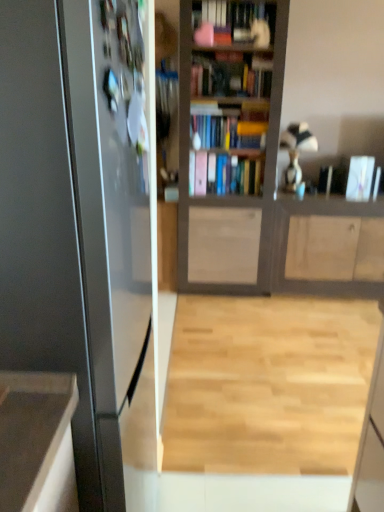
Question: From a real-world perspective, is light wood floor at center over wooden cabinet at center?

Choices:
 (A) no
 (B) yes

Answer: (A)

Question: Considering the relative sizes of light wood floor at center and wooden cabinet at center in the image provided, is light wood floor at center wider than wooden cabinet at center?

Choices:
 (A) no
 (B) yes

Answer: (B)

Question: Is light wood floor at center taller than wooden cabinet at center?

Choices:
 (A) yes
 (B) no

Answer: (B)

Question: Is light wood floor at center surrounding wooden cabinet at center?

Choices:
 (A) yes
 (B) no

Answer: (B)

Question: Is light wood floor at center directly adjacent to wooden cabinet at center?

Choices:
 (A) yes
 (B) no

Answer: (B)

Question: Is light wood floor at center taller or shorter than wooden cabinet at center?

Choices:
 (A) short
 (B) tall

Answer: (A)

Question: From the image's perspective, is light wood floor at center positioned above or below wooden cabinet at center?

Choices:
 (A) below
 (B) above

Answer: (A)

Question: Based on their sizes in the image, would you say light wood floor at center is bigger or smaller than wooden cabinet at center?

Choices:
 (A) big
 (B) small

Answer: (B)

Question: Is light wood floor at center in front of or behind wooden cabinet at center in the image?

Choices:
 (A) front
 (B) behind

Answer: (A)

Question: From a real-world perspective, is metallic refrigerator at left positioned above or below pink matte book at center, which is counted as the 2th book, starting from the right?

Choices:
 (A) below
 (B) above

Answer: (A)

Question: Considering the relative positions of metallic refrigerator at left and pink matte book at center, which is counted as the 2th book, starting from the right, in the image provided, is metallic refrigerator at left to the left or to the right of pink matte book at center, which is counted as the 2th book, starting from the right,?

Choices:
 (A) right
 (B) left

Answer: (B)

Question: From the image's perspective, is metallic refrigerator at left located above or below pink matte book at center, which is counted as the 2th book, starting from the right?

Choices:
 (A) below
 (B) above

Answer: (A)

Question: Is point (36, 356) closer or farther from the camera than point (228, 159)?

Choices:
 (A) farther
 (B) closer

Answer: (B)

Question: Is light wood floor at center inside or outside of metallic refrigerator at left?

Choices:
 (A) outside
 (B) inside

Answer: (A)

Question: Does point [x=319, y=325] appear closer or farther from the camera than point [x=94, y=423]?

Choices:
 (A) farther
 (B) closer

Answer: (A)